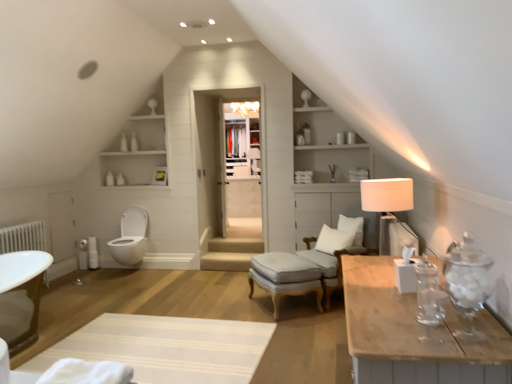
Question: Considering the positions of clear glass door at center and white soft pillow at center, placed as the 2th pillow when sorted from bottom to top, in the image, is clear glass door at center wider or thinner than white soft pillow at center, placed as the 2th pillow when sorted from bottom to top,?

Choices:
 (A) thin
 (B) wide

Answer: (A)

Question: From their relative heights in the image, would you say clear glass door at center is taller or shorter than white soft pillow at center, placed as the 2th pillow when sorted from bottom to top?

Choices:
 (A) tall
 (B) short

Answer: (A)

Question: Estimate the real-world distances between objects in this image. Which object is farther from the white wood drawer at center?

Choices:
 (A) white textured rug at lower center
 (B) white glossy toilet at lower left
 (C) clear glass door at center
 (D) white fabric swivel chair at center-right
 (E) light gray fabric stool at center

Answer: (A)

Question: Considering the real-world distances, which object is farthest from the white fabric swivel chair at center-right?

Choices:
 (A) white wood shelves at upper left
 (B) white wood drawer at center
 (C) light gray fabric stool at center
 (D) clear glass door at center
 (E) white wood shelves at upper center

Answer: (A)